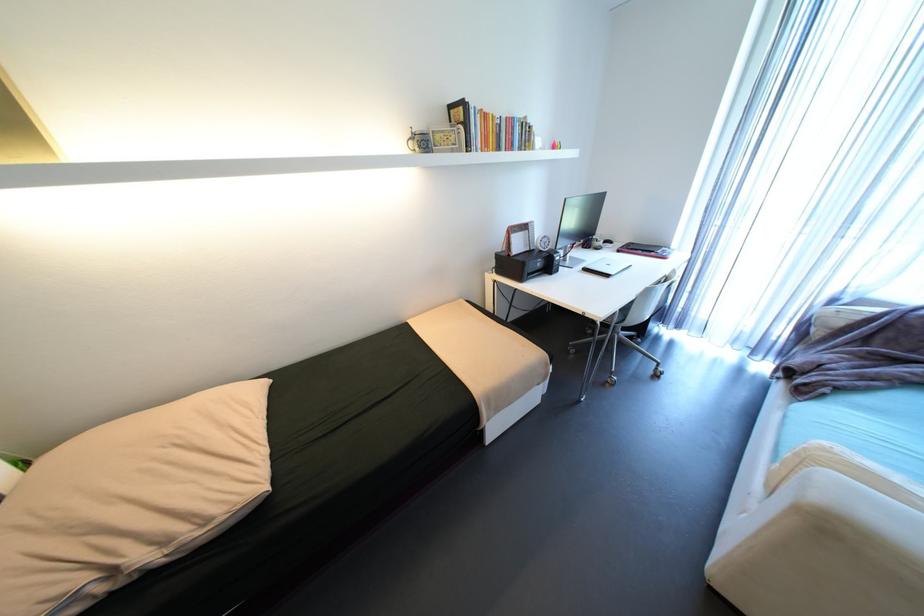
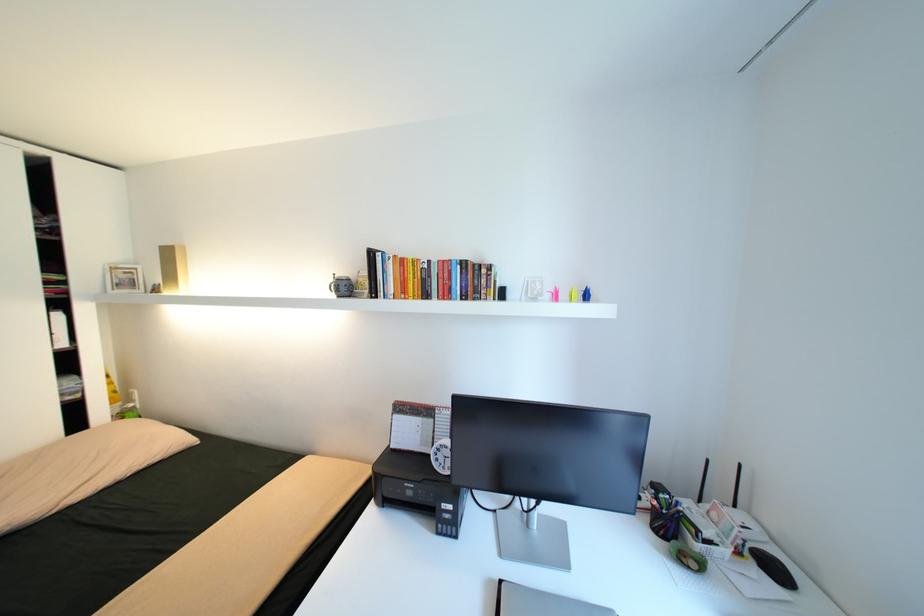
Find the pixel in the second image that matches (537,225) in the first image.

(444, 411)